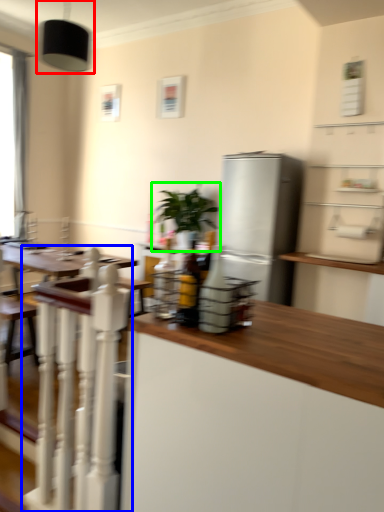
Question: Which object is positioned closest to light fixture (highlighted by a red box)? Select from rail (highlighted by a blue box) and houseplant (highlighted by a green box).

Choices:
 (A) rail
 (B) houseplant

Answer: (B)